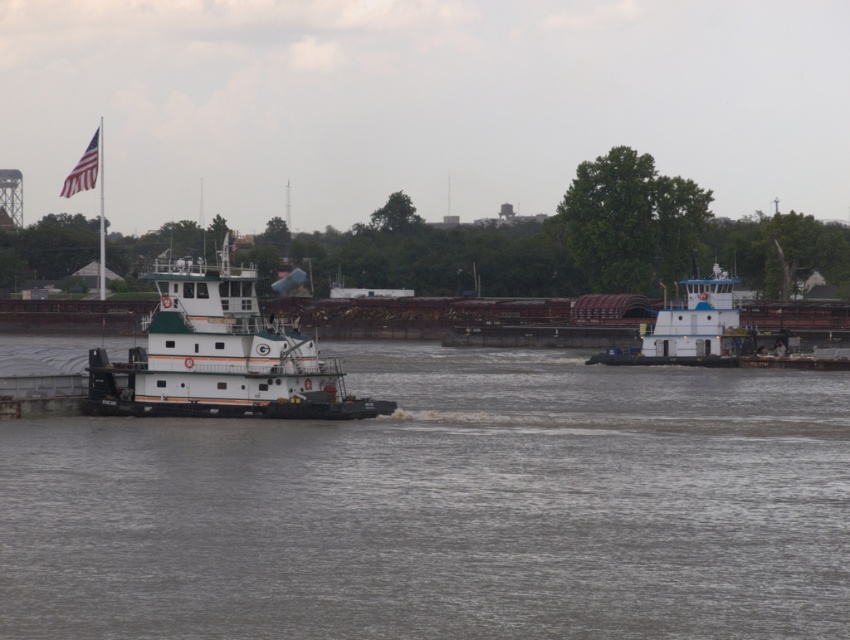
What is the color and texture of the water at the point with coordinates (445, 508)?

The gray matte water at center is represented by point (445, 508).

You are standing on the riverbank and see the white matte tugboat at center. If you want to throw a lifebuoy to someone on the tugboat, and the lifebuoy can travel 50 meters, will it reach them?

The white matte tugboat at center is 51.93 meters away from viewer, so the lifebuoy cannot reach them as it can only travel 50 meters.